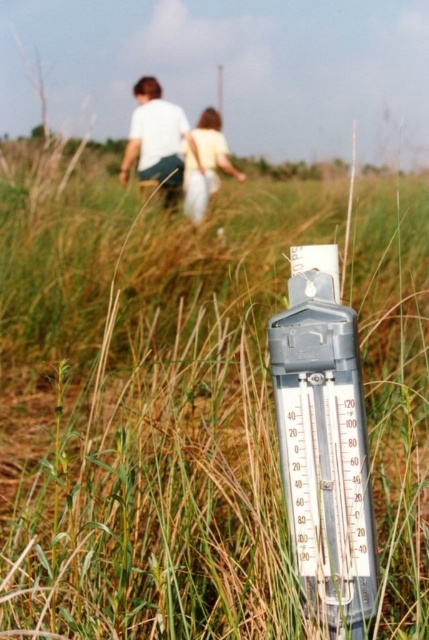
Question: Is white cotton shirt at upper center to the right of light yellow fabric dress at center from the viewer's perspective?

Choices:
 (A) yes
 (B) no

Answer: (B)

Question: From the image, what is the correct spatial relationship of white cotton shirt at upper center in relation to light yellow fabric dress at center?

Choices:
 (A) above
 (B) below

Answer: (A)

Question: Which point is farther to the camera?

Choices:
 (A) (181, 170)
 (B) (187, 147)

Answer: (B)

Question: Can you confirm if white cotton shirt at upper center is positioned to the right of light yellow fabric dress at center?

Choices:
 (A) no
 (B) yes

Answer: (A)

Question: Which object is closer to the camera taking this photo?

Choices:
 (A) light yellow fabric dress at center
 (B) white cotton shirt at upper center

Answer: (A)